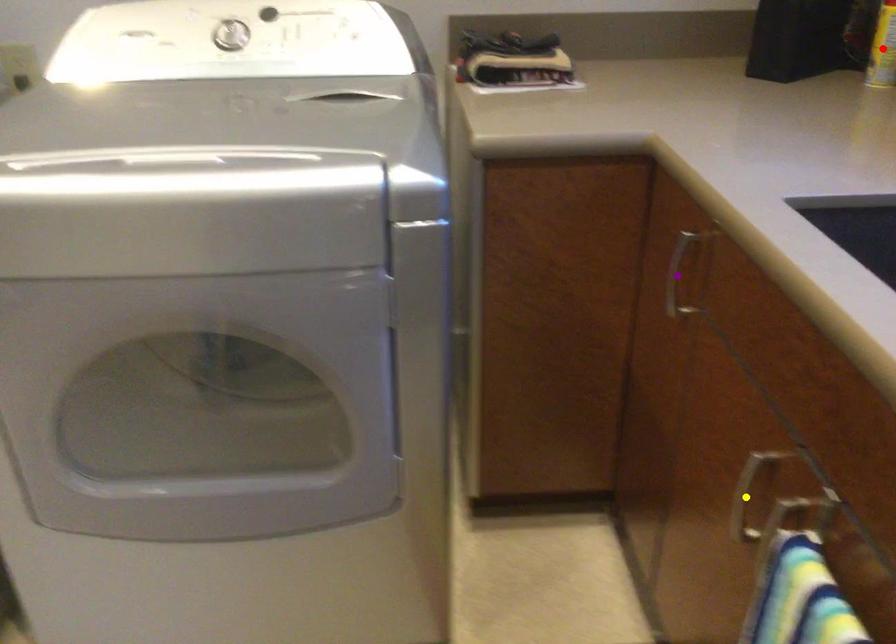
Order these from nearest to farthest:
purple point
red point
yellow point

yellow point
purple point
red point